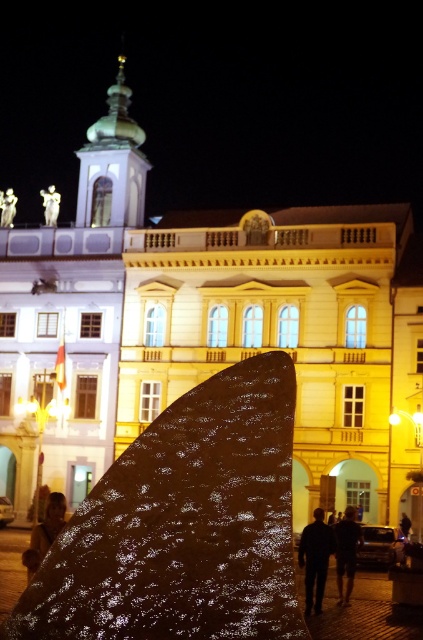
Question: Can you confirm if dark blue jeans at lower center is positioned to the right of dark fabric pants at lower center?

Choices:
 (A) yes
 (B) no

Answer: (B)

Question: Is dark blue jeans at lower center smaller than white marble statue at upper left?

Choices:
 (A) no
 (B) yes

Answer: (A)

Question: Which object is farther from the camera taking this photo?

Choices:
 (A) white marble statue at upper left
 (B) brown leather jacket at lower left

Answer: (A)

Question: Which of these objects is positioned closest to the dark fabric pants at lower center?

Choices:
 (A) brown leather jacket at lower left
 (B) dark blue jeans at lower center

Answer: (B)

Question: Can you confirm if dark fabric pants at lower center is thinner than white marble statue at upper left?

Choices:
 (A) yes
 (B) no

Answer: (B)

Question: Which object is the farthest from the brown leather jacket at lower left?

Choices:
 (A) dark fabric pants at lower center
 (B) white marble statue at upper left

Answer: (B)